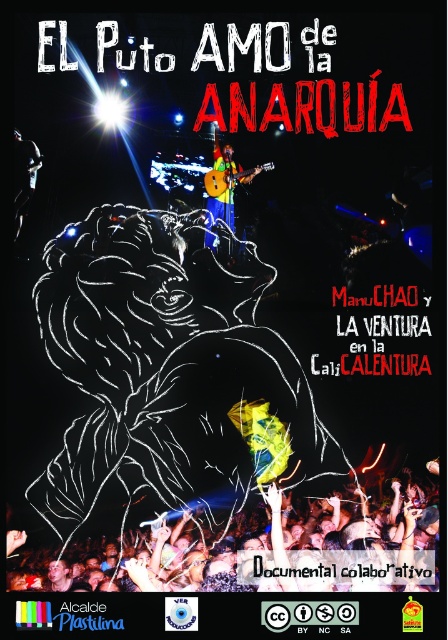
Which of these two, matte black crowd at lower center or green fabric guitar at upper center, stands taller?

green fabric guitar at upper center is taller.

The image size is (448, 640). Find the location of `matte black crowd at lower center`. matte black crowd at lower center is located at coordinates (x=262, y=552).